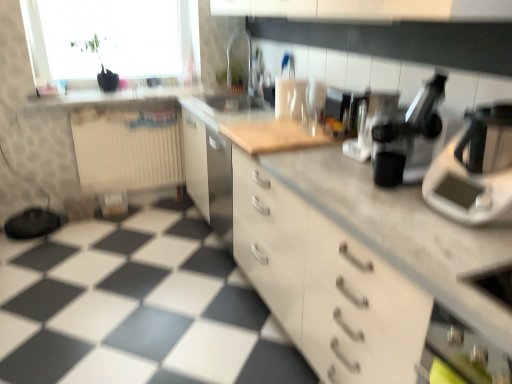
What do you see at coordinates (238, 78) in the screenshot? I see `transparent glass sink at center` at bounding box center [238, 78].

Identify the location of white matte cabinet at center. (325, 283).

Measure the distance between point [369,131] and camera.

Point [369,131] and camera are 1.80 meters apart.

Where is `beige ribbed radiator at left`? The width and height of the screenshot is (512, 384). beige ribbed radiator at left is located at coordinates (127, 150).

What is the approximate height of matte white countertop at upper center?

It is 1.54 inches.

In order to face matte white countertop at upper center, should I rotate leftwards or rightwards?

It's best to rotate left around 17.215 degrees.

Image resolution: width=512 pixels, height=384 pixels. I want to click on transparent glass sink at center, so click(238, 78).

Looking at this image, from the image's perspective, would you say matte white countertop at upper center is shown under sleek black coffee machine at center, which is counted as the first coffee machine, starting from the back?

Actually, matte white countertop at upper center appears above sleek black coffee machine at center, which is counted as the first coffee machine, starting from the back, in the image.

Is matte white countertop at upper center positioned far away from sleek black coffee machine at center, which is counted as the third coffee machine, starting from the front?

Indeed, matte white countertop at upper center is not near sleek black coffee machine at center, which is counted as the third coffee machine, starting from the front.

Would you say sleek black coffee machine at center, which is counted as the third coffee machine, starting from the front, is part of matte white countertop at upper center's contents?

No, matte white countertop at upper center does not contain sleek black coffee machine at center, which is counted as the third coffee machine, starting from the front.

In the image, there is a sleek black coffee machine at center, which is counted as the first coffee machine, starting from the back. Identify the location of counter top below it (from a real-world perspective). click(x=117, y=98).

Which object is positioned more to the left, white matte cabinet at center or white plastic scale at right?

From the viewer's perspective, white matte cabinet at center appears more on the left side.

Is white matte cabinet at center facing towards white plastic scale at right?

No, white matte cabinet at center is not aimed at white plastic scale at right.

From the image's perspective, is white matte cabinet at center located above or below white plastic scale at right?

white matte cabinet at center is below white plastic scale at right.

Is transparent glass window at upper left directly adjacent to white matte cabinet at center?

transparent glass window at upper left is not next to white matte cabinet at center, and they're not touching.

In the scene shown: Is transparent glass window at upper left located outside white matte cabinet at center?

Indeed, transparent glass window at upper left is completely outside white matte cabinet at center.

Considering the sizes of objects transparent glass window at upper left and white matte cabinet at center in the image provided, who is shorter, transparent glass window at upper left or white matte cabinet at center?

transparent glass window at upper left.

From the picture: Considering the sizes of transparent glass window at upper left and white matte cabinet at center in the image, is transparent glass window at upper left wider or thinner than white matte cabinet at center?

Clearly, transparent glass window at upper left has less width compared to white matte cabinet at center.

Is white matte cabinet at center shorter than transparent glass sink at center?

No, white matte cabinet at center is not shorter than transparent glass sink at center.

Who is smaller, white matte cabinet at center or transparent glass sink at center?

transparent glass sink at center is smaller.

Is point (326, 298) positioned before point (249, 47)?

Yes, point (326, 298) is in front of point (249, 47).

Does white matte cabinet at center turn towards transparent glass sink at center?

No.

Are beige ribbed radiator at left and black plastic coffee machine at center, arranged as the 2th coffee machine when viewed from the front, beside each other?

No, beige ribbed radiator at left is not in contact with black plastic coffee machine at center, arranged as the 2th coffee machine when viewed from the front.

You are a GUI agent. You are given a task and a screenshot of the screen. Output one action in this format:
    pyautogui.click(x=<x>, y=<y>)
    Task: Click on the 2nd coffee machine positioned above the beige ribbed radiator at left (from a real-world perspective)
    
    Given the screenshot: What is the action you would take?
    pyautogui.click(x=367, y=120)

Is beige ribbed radiator at left oriented towards black plastic coffee machine at center, arranged as the 2th coffee machine when viewed from the front?

Yes, beige ribbed radiator at left is facing black plastic coffee machine at center, arranged as the 2th coffee machine when viewed from the front.

Considering the sizes of objects beige ribbed radiator at left and black plastic coffee machine at center, placed as the second coffee machine when sorted from back to front, in the image provided, who is wider, beige ribbed radiator at left or black plastic coffee machine at center, placed as the second coffee machine when sorted from back to front,?

With larger width is black plastic coffee machine at center, placed as the second coffee machine when sorted from back to front.

From the image's perspective, which one is positioned lower, white plastic scale at right or white matte cabinet at center?

white matte cabinet at center appears lower in the image.

Between point (507, 151) and point (267, 179), which one is positioned in front?

The point (507, 151) is more forward.

Is white matte cabinet at center completely or partially inside white plastic scale at right?

No, white matte cabinet at center is located outside of white plastic scale at right.

Considering the relative positions of white plastic scale at right and white matte cabinet at center in the image provided, is white plastic scale at right behind white matte cabinet at center?

That is True.

From a real-world perspective, which object stands above the other?

transparent glass sink at center.

Considering the sizes of metallic silver coffee machine at upper right, which appears as the third coffee machine when viewed from the back, and transparent glass sink at center in the image, is metallic silver coffee machine at upper right, which appears as the third coffee machine when viewed from the back, wider or thinner than transparent glass sink at center?

Clearly, metallic silver coffee machine at upper right, which appears as the third coffee machine when viewed from the back, has less width compared to transparent glass sink at center.

From the picture: Which is more to the left, metallic silver coffee machine at upper right, which appears as the third coffee machine when viewed from the back, or transparent glass sink at center?

From the viewer's perspective, transparent glass sink at center appears more on the left side.

Considering the positions of objects metallic silver coffee machine at upper right, which appears as the third coffee machine when viewed from the back, and transparent glass sink at center in the image provided, who is behind, metallic silver coffee machine at upper right, which appears as the third coffee machine when viewed from the back, or transparent glass sink at center?

transparent glass sink at center is behind.

Identify the location of counter top behind the sleek black coffee machine at center, which is counted as the third coffee machine, starting from the front. This screenshot has width=512, height=384. (117, 98).

You are a GUI agent. You are given a task and a screenshot of the screen. Output one action in this format:
    pyautogui.click(x=<x>, y=<y>)
    Task: Click on the cabinetry located underneath the white plastic scale at right (from a real-world perspective)
    This screenshot has width=512, height=384.
    Given the screenshot: What is the action you would take?
    pyautogui.click(x=325, y=283)

Looking at the image, which one is located further to sleek black coffee machine at center, which is counted as the third coffee machine, starting from the front, transparent glass window at upper left or beige ribbed radiator at left?

The object further to sleek black coffee machine at center, which is counted as the third coffee machine, starting from the front, is transparent glass window at upper left.

When comparing their distances from beige ribbed radiator at left, does transparent glass window at upper left or sleek black coffee machine at center, which is counted as the third coffee machine, starting from the front, seem further?

Based on the image, sleek black coffee machine at center, which is counted as the third coffee machine, starting from the front, appears to be further to beige ribbed radiator at left.

Which object lies nearer to the anchor point transparent glass window at upper left, matte white countertop at upper center or white plastic scale at right?

matte white countertop at upper center lies closer to transparent glass window at upper left than the other object.

When comparing their distances from beige ribbed radiator at left, does white plastic scale at right or metallic silver coffee machine at upper right, which appears as the third coffee machine when viewed from the back, seem further?

Among the two, white plastic scale at right is located further to beige ribbed radiator at left.

Based on their spatial positions, is black plastic coffee machine at center, arranged as the 2th coffee machine when viewed from the front, or white matte cabinet at center further from sleek black coffee machine at center, which is counted as the first coffee machine, starting from the back?

white matte cabinet at center is further to sleek black coffee machine at center, which is counted as the first coffee machine, starting from the back.

Estimate the real-world distances between objects in this image. Which object is closer to white plastic scale at right, metallic silver coffee machine at upper right, which appears as the third coffee machine when viewed from the back, or black plastic coffee machine at center, arranged as the 2th coffee machine when viewed from the front?

The object closer to white plastic scale at right is metallic silver coffee machine at upper right, which appears as the third coffee machine when viewed from the back.

When comparing their distances from sleek black coffee machine at center, which is counted as the first coffee machine, starting from the back, does matte white countertop at upper center or white matte cabinet at center seem closer?

white matte cabinet at center.

Looking at the image, which one is located further to metallic silver coffee machine at upper right, the 1th coffee machine from the front, black plastic coffee machine at center, placed as the second coffee machine when sorted from back to front, or transparent glass sink at center?

Among the two, transparent glass sink at center is located further to metallic silver coffee machine at upper right, the 1th coffee machine from the front.

Identify the location of window between white plastic scale at right and beige ribbed radiator at left from front to back. (113, 38).

The image size is (512, 384). I want to click on counter top between transparent glass window at upper left and beige ribbed radiator at left in the up-down direction, so tap(117, 98).

Where is `sink situated between transparent glass window at upper left and metallic silver coffee machine at upper right, which appears as the third coffee machine when viewed from the back, from left to right`? sink situated between transparent glass window at upper left and metallic silver coffee machine at upper right, which appears as the third coffee machine when viewed from the back, from left to right is located at coordinates (238, 78).

What are the coordinates of `sink located between beige ribbed radiator at left and sleek black coffee machine at center, which is counted as the third coffee machine, starting from the front, in the left-right direction` in the screenshot? It's located at (238, 78).